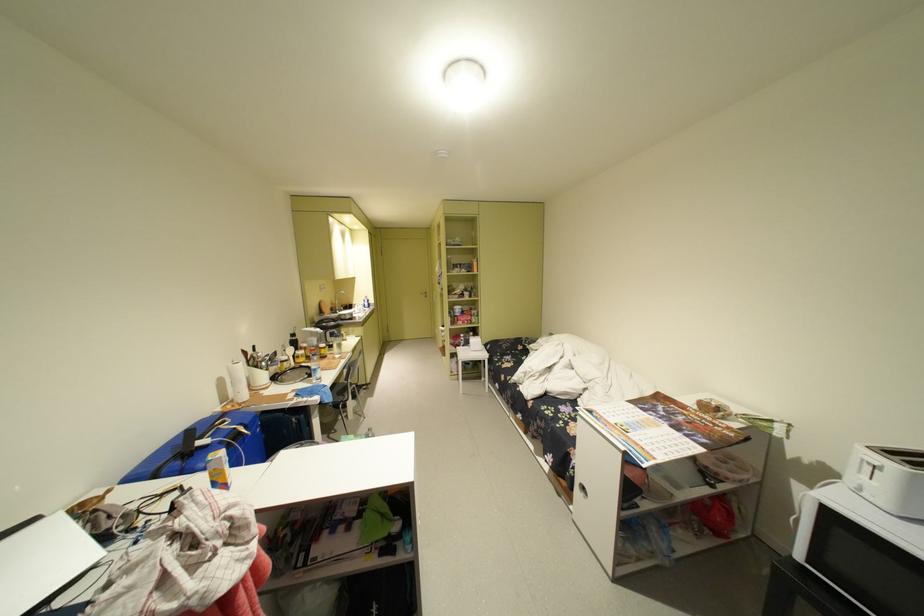
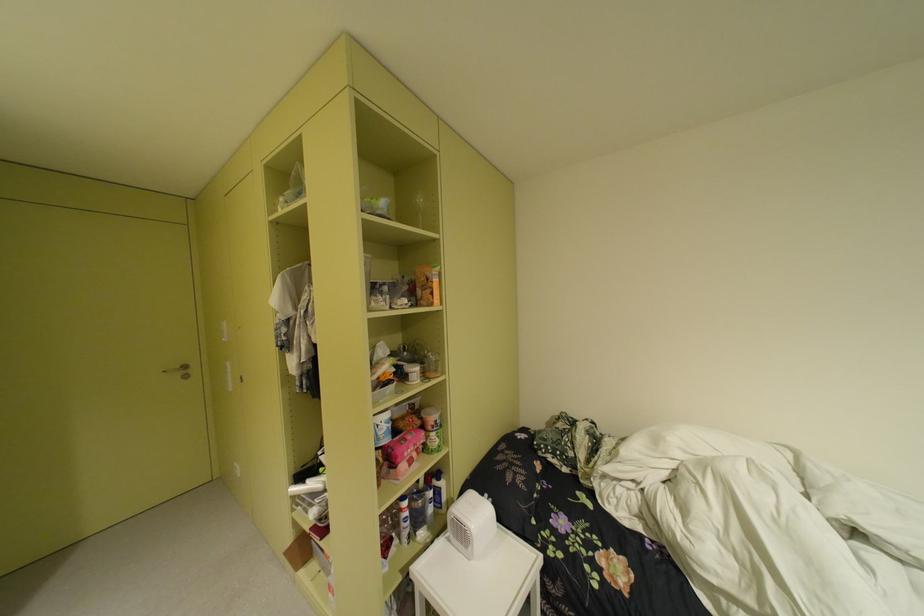
Locate, in the second image, the point that corresponds to (x=475, y=270) in the first image.

(417, 301)